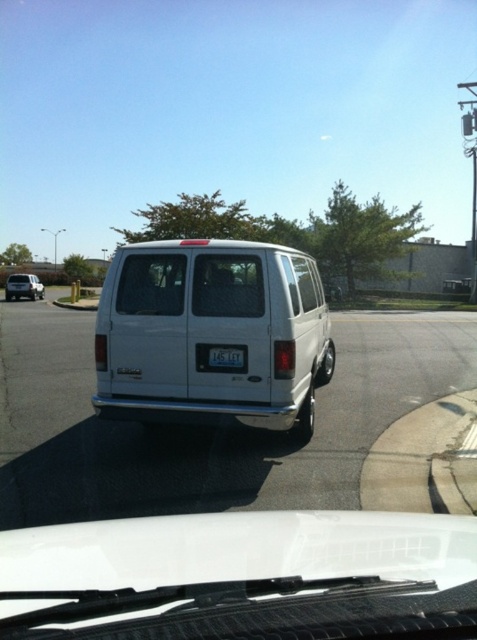
Between white matte van at left and white plastic license plate at center, which one appears on the right side from the viewer's perspective?

Positioned to the right is white plastic license plate at center.

Is white matte van at left to the right of white plastic license plate at center from the viewer's perspective?

Incorrect, white matte van at left is not on the right side of white plastic license plate at center.

Who is more distant from viewer, [40,289] or [245,353]?

The point [40,289] is behind.

Locate an element on the screen. white matte van at left is located at coordinates (23, 285).

Is white matte van at center behind white plastic license plate at center?

No, white matte van at center is closer to the viewer.

Between point (177, 356) and point (207, 356), which one is positioned in front?

Point (207, 356)

Identify the location of white matte van at center. (211, 332).

Which is more to the left, white matte van at center or transparent glass windshield at rear?

From the viewer's perspective, white matte van at center appears more on the left side.

What do you see at coordinates (211, 332) in the screenshot?
I see `white matte van at center` at bounding box center [211, 332].

Find the location of a particular element. white matte van at center is located at coordinates (211, 332).

Find the location of `white matte van at center`. white matte van at center is located at coordinates (211, 332).